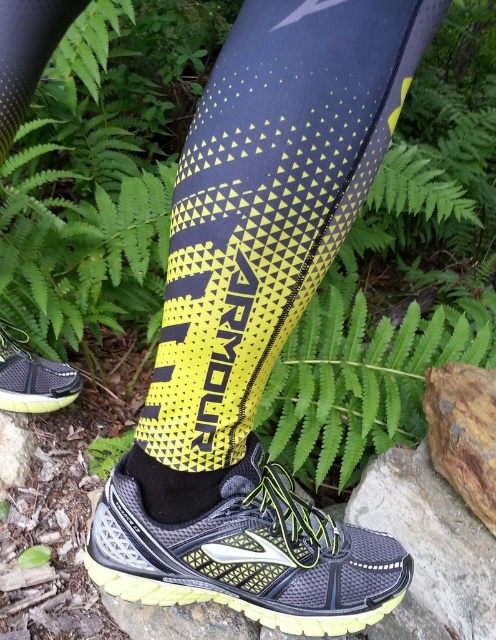
Looking at this image, you are a physical therapist assessing a patient who just underwent ankle surgery. You need to ensure proper healing by keeping the foot elevated. The patient has a matte black shoe at lower left and a black mesh sock at lower center. Which object should you focus on to properly elevate the foot for healing?

The matte black shoe at lower left should be focused on to properly elevate the foot for healing since it is the footwear directly attached to the foot, and the black mesh sock at lower center is part of the sock, which is under the shoe.

You are a physical therapist assessing a patient who needs to choose between the matte black shoe at lower left and the black mesh sock at lower center for an outdoor activity. Based on their widths, which one provides more space for the foot?

The matte black shoe at lower left has a larger width than the black mesh sock at lower center, so it provides more space for the foot.